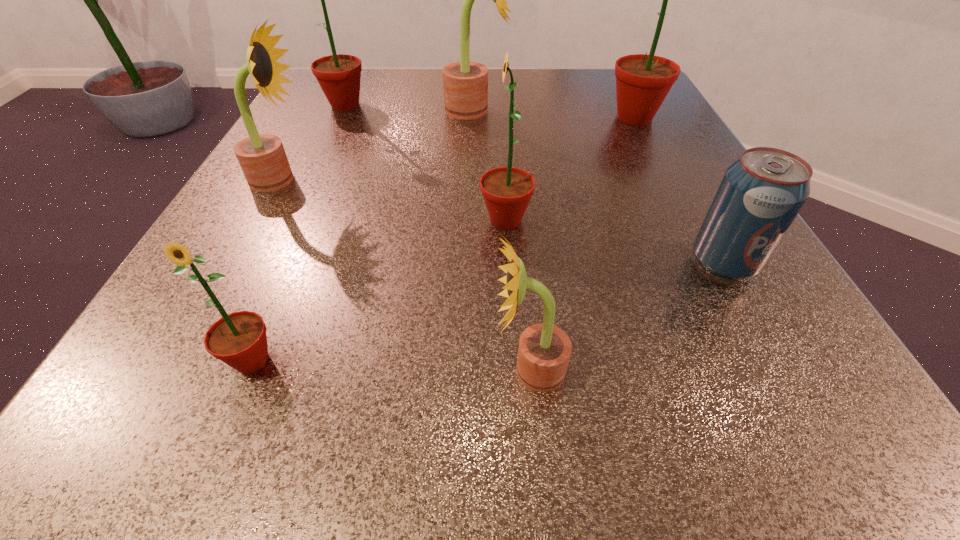
This screenshot has height=540, width=960. I want to click on green sunflower that can be found as the third closest to the tallest sunflower, so click(x=239, y=339).

Identify which yellow sunflower is the closest to the fifth nearest object. Please provide its 2D coordinates. Your answer should be formatted as a tuple, i.e. [(x, y)], where the tuple contains the x and y coordinates of a point satisfying the conditions above.

[(465, 84)]

Identify the location of yellow sunflower that stands as the third closest to the fifth farthest sunflower. The width and height of the screenshot is (960, 540). (262, 158).

Locate an element on the screen. free space that satisfies the following two spatial constraints: 1. on the face of the tallest object; 2. on the face of the smallest green sunflower is located at coordinates (761, 360).

Find the location of a particular element. The height and width of the screenshot is (540, 960). vacant area in the image that satisfies the following two spatial constraints: 1. on the face of the fifth farthest object; 2. on the face of the nearest green sunflower is located at coordinates pos(515,360).

Identify the location of free spot that satisfies the following two spatial constraints: 1. on the face of the second nearest yellow sunflower; 2. on the back side of the third nearest object. Image resolution: width=960 pixels, height=540 pixels. (235, 263).